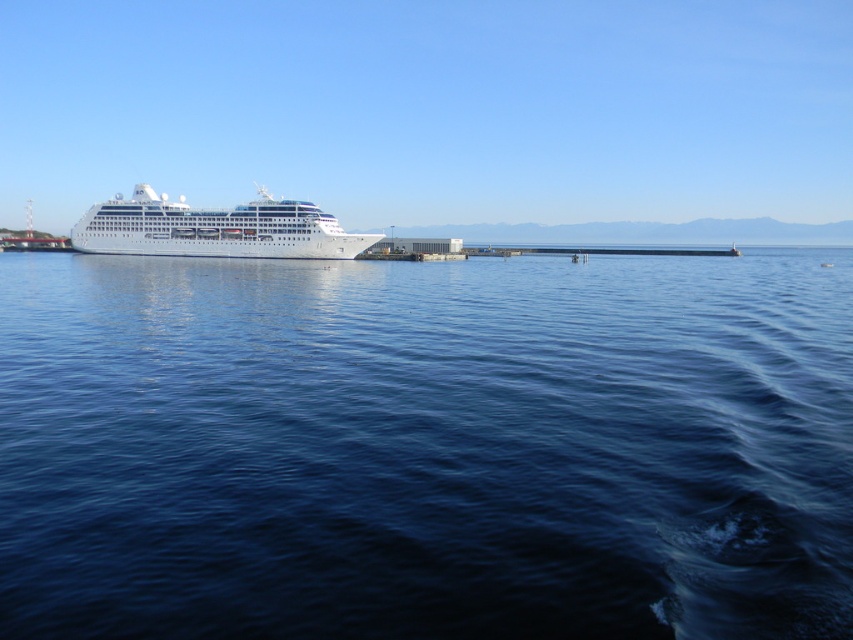
Question: Which of the following is the farthest from the observer?

Choices:
 (A) white glossy cruise ship at center
 (B) blue liquid water at center

Answer: (A)

Question: Among these points, which one is nearest to the camera?

Choices:
 (A) coord(234,228)
 (B) coord(828,627)

Answer: (B)

Question: Can you confirm if blue liquid water at center is positioned below white glossy cruise ship at center?

Choices:
 (A) no
 (B) yes

Answer: (B)

Question: Which point is closer to the camera?

Choices:
 (A) blue liquid water at center
 (B) white glossy cruise ship at center

Answer: (A)

Question: Is blue liquid water at center to the left of white glossy cruise ship at center from the viewer's perspective?

Choices:
 (A) yes
 (B) no

Answer: (B)

Question: Is blue liquid water at center thinner than white glossy cruise ship at center?

Choices:
 (A) no
 (B) yes

Answer: (A)